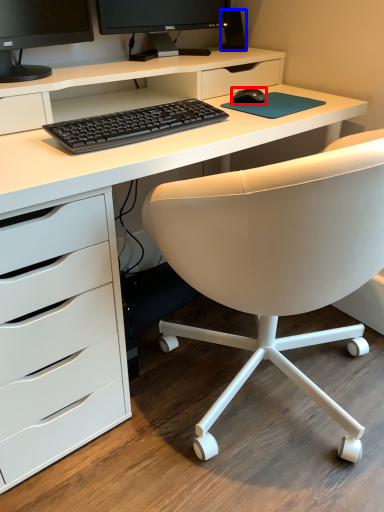
Question: Which object appears closest to the camera in this image, mouse (highlighted by a red box) or speaker (highlighted by a blue box)?

Choices:
 (A) mouse
 (B) speaker

Answer: (A)